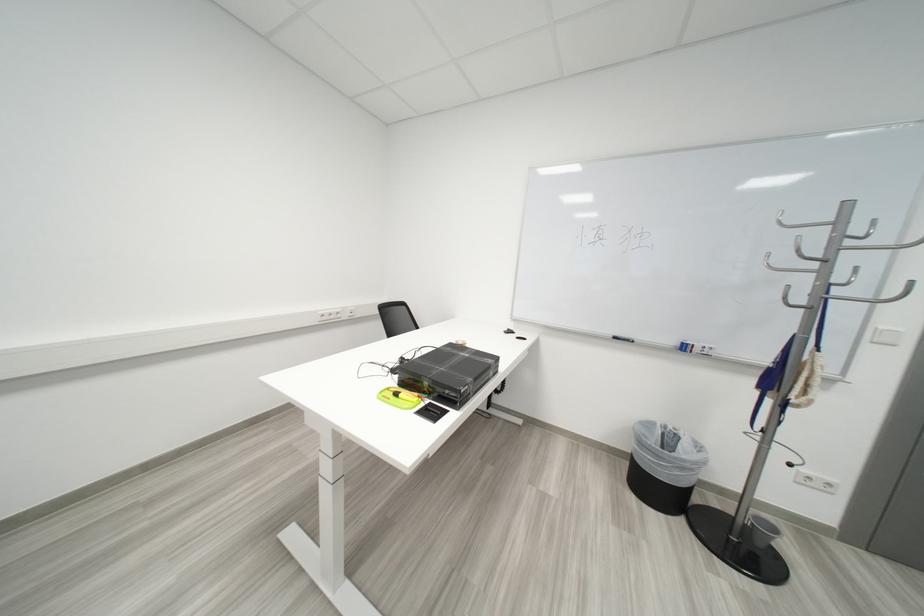
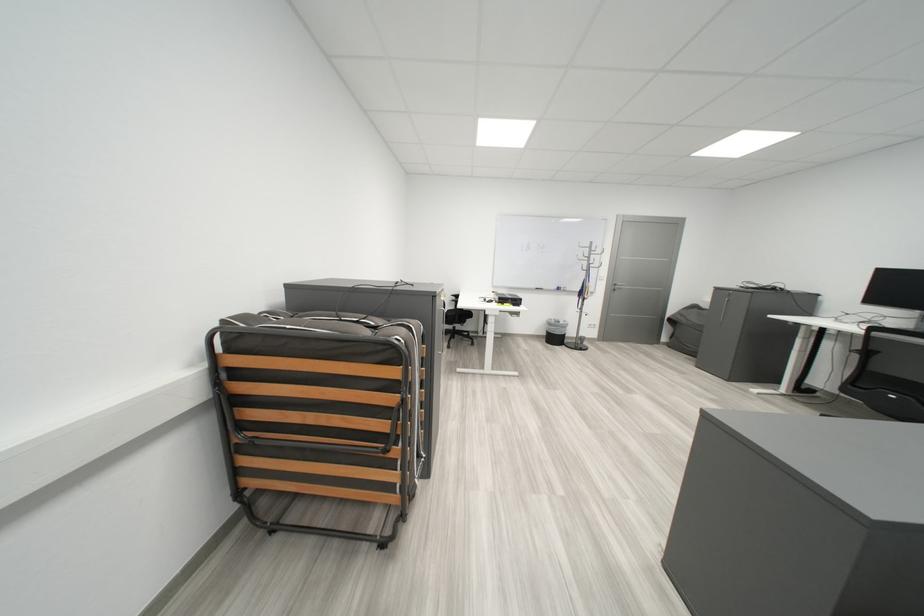
The images are taken continuously from a first-person perspective. In which direction are you moving?

The movement direction of the cameraman is left, backward.